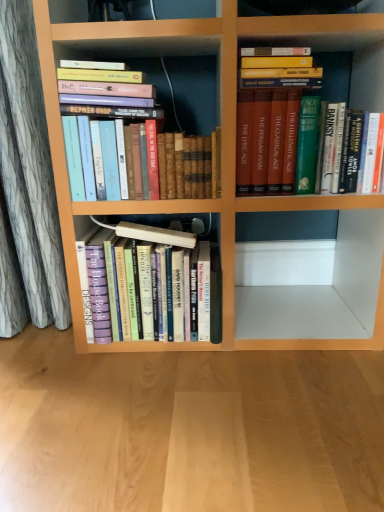
The image size is (384, 512). Find the location of `vacant space in front of hardcover books at center, which ranks as the 2th book in right-to-left order`. vacant space in front of hardcover books at center, which ranks as the 2th book in right-to-left order is located at coordinates (148, 386).